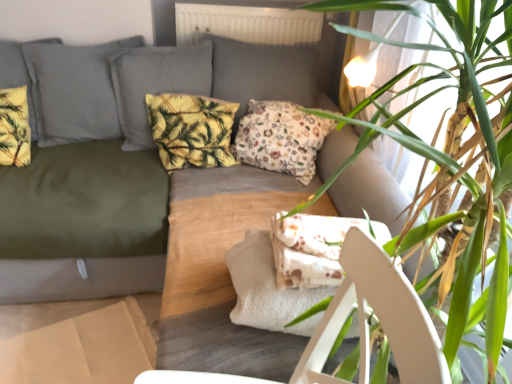
Measure the distance between floral fabric pillow at center, the 1th pillow positioned from the right, and camera.

They are 1.86 meters apart.

What do you see at coordinates (281, 138) in the screenshot? The image size is (512, 384). I see `floral fabric pillow at center, the 1th pillow positioned from the right` at bounding box center [281, 138].

Identify the location of white cardboard box at lower left. (79, 340).

The image size is (512, 384). Identify the location of green leafy plant at upper right. (459, 163).

Describe the element at coordinates (14, 127) in the screenshot. I see `yellow floral fabric pillow at upper left, which appears as the 1th pillow when viewed from the left` at that location.

Identify the location of yellow floral fabric pillow at upper left, marked as the 3th pillow in a right-to-left arrangement. The width and height of the screenshot is (512, 384). (x=14, y=127).

Where is `yellow fabric pillow at center, the 2th pillow positioned from the left`? The width and height of the screenshot is (512, 384). yellow fabric pillow at center, the 2th pillow positioned from the left is located at coordinates (191, 130).

The image size is (512, 384). I want to click on floral fabric pillow at center, the 1th pillow positioned from the right, so click(x=281, y=138).

What's the angular difference between olive green fabric couch at upper left and white fabric armchair at center's facing directions?

94.1 degrees.

How much distance is there between olive green fabric couch at upper left and white fabric armchair at center?

olive green fabric couch at upper left is 39.13 inches from white fabric armchair at center.

Is point (91, 227) closer to camera compared to point (344, 293)?

No, it is not.

Which object is thinner, olive green fabric couch at upper left or white fabric armchair at center?

Thinner between the two is white fabric armchair at center.

Does white cardboard box at lower left have a lesser height compared to green leafy plant at upper right?

Correct, white cardboard box at lower left is not as tall as green leafy plant at upper right.

Is white cardboard box at lower left oriented away from green leafy plant at upper right?

No, green leafy plant at upper right is not at the back of white cardboard box at lower left.

Is white cardboard box at lower left far away from green leafy plant at upper right?

Absolutely, white cardboard box at lower left is distant from green leafy plant at upper right.

What's the angular difference between white cardboard box at lower left and green leafy plant at upper right's facing directions?

There is a 19.1-degree angle between the facing directions of white cardboard box at lower left and green leafy plant at upper right.

Considering the sizes of objects olive green fabric couch at upper left and white plastic radiator at upper center in the image provided, who is smaller, olive green fabric couch at upper left or white plastic radiator at upper center?

white plastic radiator at upper center.

The image size is (512, 384). In order to click on studio couch located underneath the white plastic radiator at upper center (from a real-world perspective) in this screenshot , I will do `click(83, 223)`.

Would you say white plastic radiator at upper center is part of olive green fabric couch at upper left's contents?

No, white plastic radiator at upper center is not inside olive green fabric couch at upper left.

Considering the sizes of objects floral fabric pillow at center, the 1th pillow positioned from the right, and yellow floral fabric pillow at upper left, marked as the 3th pillow in a right-to-left arrangement, in the image provided, who is bigger, floral fabric pillow at center, the 1th pillow positioned from the right, or yellow floral fabric pillow at upper left, marked as the 3th pillow in a right-to-left arrangement,?

floral fabric pillow at center, the 1th pillow positioned from the right, is bigger.

Between floral fabric pillow at center, acting as the third pillow starting from the left, and yellow floral fabric pillow at upper left, which appears as the 1th pillow when viewed from the left, which one has more height?

floral fabric pillow at center, acting as the third pillow starting from the left.

From a real-world perspective, is floral fabric pillow at center, the 1th pillow positioned from the right, positioned above or below yellow floral fabric pillow at upper left, which appears as the 1th pillow when viewed from the left?

From a real-world perspective, floral fabric pillow at center, the 1th pillow positioned from the right, is physically below yellow floral fabric pillow at upper left, which appears as the 1th pillow when viewed from the left.

Could you measure the distance between floral fabric pillow at center, the 1th pillow positioned from the right, and yellow floral fabric pillow at upper left, which appears as the 1th pillow when viewed from the left?

1.08 meters.

Are green leafy plant at upper right and white cardboard box at lower left far apart?

Yes.

Is the depth of green leafy plant at upper right greater than that of white cardboard box at lower left?

No, it is not.

Is green leafy plant at upper right not inside white cardboard box at lower left?

Absolutely, green leafy plant at upper right is external to white cardboard box at lower left.

Which point is more distant from viewer, (479, 101) or (97, 371)?

The point (97, 371) is farther from the camera.

Is white cardboard box at lower left positioned with its back to white fabric armchair at center?

That's not correct — white cardboard box at lower left is not looking away from white fabric armchair at center.

At what (x,y) coordinates should I click in order to perform the action: click on cardboard box behind the white fabric armchair at center. Please return your answer as a coordinate pair (x, y). Looking at the image, I should click on (79, 340).

Considering the sizes of objects white cardboard box at lower left and white fabric armchair at center in the image provided, who is smaller, white cardboard box at lower left or white fabric armchair at center?

Smaller between the two is white cardboard box at lower left.

Is white cardboard box at lower left to the left of white fabric armchair at center from the viewer's perspective?

Yes.

Is yellow fabric pillow at center, which is counted as the second pillow, starting from the right, inside white cardboard box at lower left?

No.

From a real-world perspective, does white cardboard box at lower left stand above yellow fabric pillow at center, which is counted as the second pillow, starting from the right?

Actually, white cardboard box at lower left is physically below yellow fabric pillow at center, which is counted as the second pillow, starting from the right, in the real world.

Are white cardboard box at lower left and yellow fabric pillow at center, which is counted as the second pillow, starting from the right, making contact?

No, white cardboard box at lower left is not beside yellow fabric pillow at center, which is counted as the second pillow, starting from the right.

Identify the location of armchair lying on the right of olive green fabric couch at upper left. Image resolution: width=512 pixels, height=384 pixels. click(378, 316).

This screenshot has width=512, height=384. Find the location of `cardboard box below the green leafy plant at upper right (from a real-world perspective)`. cardboard box below the green leafy plant at upper right (from a real-world perspective) is located at coordinates (79, 340).

Based on their spatial positions, is green leafy plant at upper right or white fabric armchair at center further from white plastic radiator at upper center?

The object further to white plastic radiator at upper center is white fabric armchair at center.

Based on their spatial positions, is white fabric armchair at center or yellow fabric pillow at center, the 2th pillow positioned from the left, closer to olive green fabric couch at upper left?

Among the two, yellow fabric pillow at center, the 2th pillow positioned from the left, is located nearer to olive green fabric couch at upper left.

Looking at the image, which one is located closer to white cardboard box at lower left, yellow floral fabric pillow at upper left, marked as the 3th pillow in a right-to-left arrangement, or yellow fabric pillow at center, the 2th pillow positioned from the left?

yellow fabric pillow at center, the 2th pillow positioned from the left, lies closer to white cardboard box at lower left than the other object.

From the image, which object appears to be nearer to yellow floral fabric pillow at upper left, marked as the 3th pillow in a right-to-left arrangement, white cardboard box at lower left or olive green fabric couch at upper left?

olive green fabric couch at upper left is closer to yellow floral fabric pillow at upper left, marked as the 3th pillow in a right-to-left arrangement.

From the image, which object appears to be farther from floral fabric pillow at center, the 1th pillow positioned from the right, yellow fabric pillow at center, which is counted as the second pillow, starting from the right, or green leafy plant at upper right?

green leafy plant at upper right is further to floral fabric pillow at center, the 1th pillow positioned from the right.

From the image, which object appears to be farther from white cardboard box at lower left, yellow fabric pillow at center, the 2th pillow positioned from the left, or white fabric armchair at center?

white fabric armchair at center is positioned further to the anchor white cardboard box at lower left.

Looking at the image, which one is located closer to white cardboard box at lower left, yellow floral fabric pillow at upper left, which appears as the 1th pillow when viewed from the left, or white plastic radiator at upper center?

yellow floral fabric pillow at upper left, which appears as the 1th pillow when viewed from the left.

Which object lies further to the anchor point white cardboard box at lower left, white fabric armchair at center or green leafy plant at upper right?

Among the two, green leafy plant at upper right is located further to white cardboard box at lower left.

I want to click on studio couch positioned between white fabric armchair at center and white plastic radiator at upper center from near to far, so click(x=83, y=223).

Find the location of a particular element. This screenshot has width=512, height=384. pillow between yellow floral fabric pillow at upper left, marked as the 3th pillow in a right-to-left arrangement, and white plastic radiator at upper center, in the horizontal direction is located at coordinates 191,130.

Identify the location of cardboard box positioned between green leafy plant at upper right and yellow floral fabric pillow at upper left, marked as the 3th pillow in a right-to-left arrangement, from near to far. The height and width of the screenshot is (384, 512). (79, 340).

Identify the location of pillow between white fabric armchair at center and floral fabric pillow at center, acting as the third pillow starting from the left, from front to back. The height and width of the screenshot is (384, 512). (14, 127).